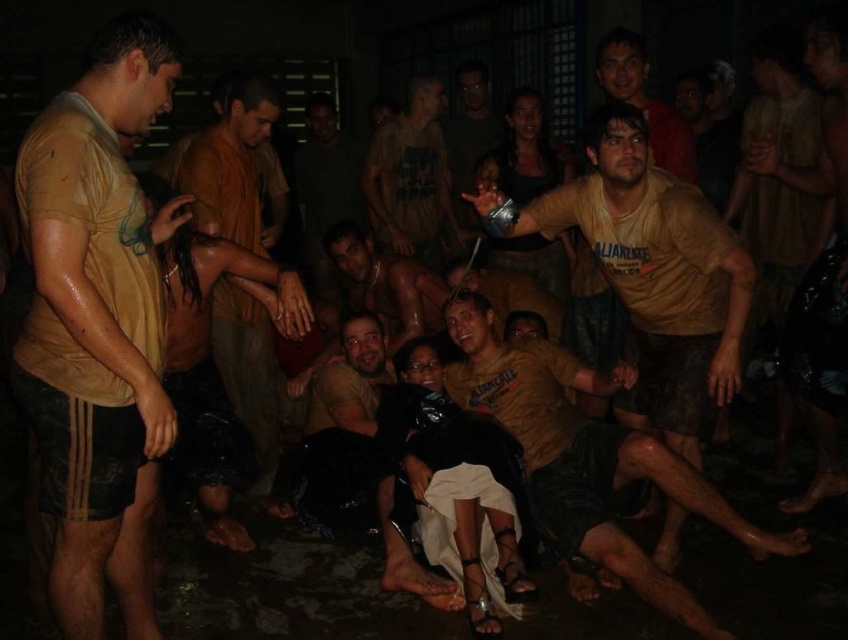
Question: Is dark brown leather jacket at center further to the viewer compared to matte yellow shirt at center?

Choices:
 (A) no
 (B) yes

Answer: (A)

Question: Which is farther from the brown cotton shirt at center?

Choices:
 (A) brown matte shorts at center
 (B) matte yellow t-shirt at center
 (C) brown matte shirt at center

Answer: (B)

Question: Does brown matte shirt at center lie behind brown cotton shirt at center?

Choices:
 (A) no
 (B) yes

Answer: (A)

Question: Which point is closer to the camera?

Choices:
 (A) (662, 104)
 (B) (226, 369)
 (C) (399, 282)

Answer: (A)

Question: Can you confirm if brown matte shorts at center is bigger than brown cotton shirt at center?

Choices:
 (A) no
 (B) yes

Answer: (B)

Question: Estimate the real-world distances between objects in this image. Which object is closer to the brown cotton shirt at center?

Choices:
 (A) brown matte shorts at center
 (B) brown leather jacket at center
 (C) dark brown leather jacket at center

Answer: (B)